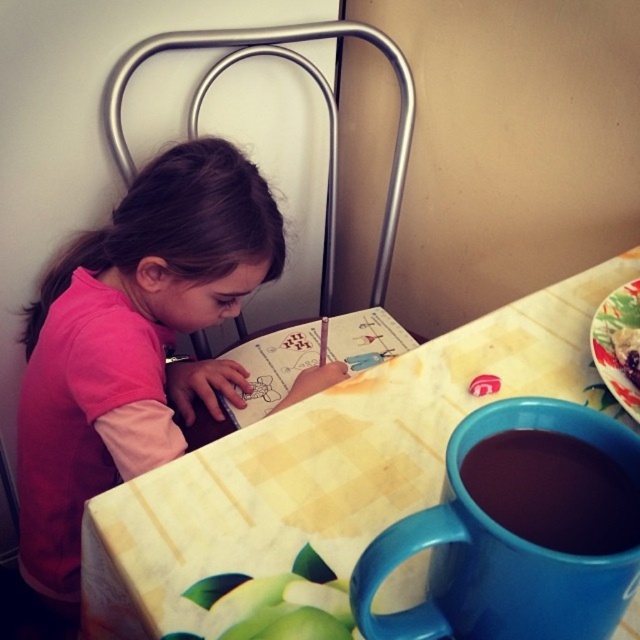
Question: Estimate the real-world distances between objects in this image. Which object is closer to the floral ceramic plate at upper right?

Choices:
 (A) dark matte mug at lower right
 (B) yellow printed table at center

Answer: (B)

Question: Which of these objects is positioned farthest from the dark matte mug at lower right?

Choices:
 (A) yellow printed table at center
 (B) floral ceramic plate at upper right
 (C) pink fabric shirt at upper left
 (D) blue glossy mug at lower right

Answer: (C)

Question: Can you confirm if yellow printed table at center is positioned below blue glossy mug at lower right?

Choices:
 (A) yes
 (B) no

Answer: (B)

Question: Does yellow printed table at center appear on the right side of blue glossy mug at lower right?

Choices:
 (A) no
 (B) yes

Answer: (B)

Question: Is pink fabric shirt at upper left positioned in front of dark matte mug at lower right?

Choices:
 (A) no
 (B) yes

Answer: (A)

Question: Considering the real-world distances, which object is farthest from the yellow printed table at center?

Choices:
 (A) blue glossy mug at lower right
 (B) floral ceramic plate at upper right
 (C) dark matte mug at lower right

Answer: (C)